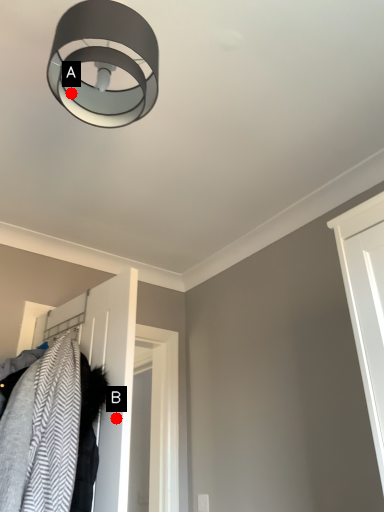
Question: Two points are circled on the image, labeled by A and B beside each circle. Which of the following is the farthest from the observer?

Choices:
 (A) A is further
 (B) B is further

Answer: (B)